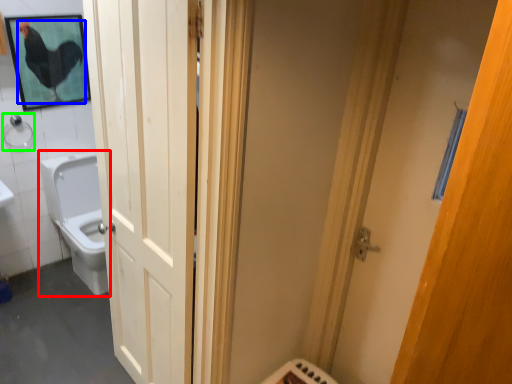
Question: Which object is positioned farthest from toilet (highlighted by a red box)? Select from chicken (highlighted by a blue box) and shower (highlighted by a green box).

Choices:
 (A) chicken
 (B) shower

Answer: (A)